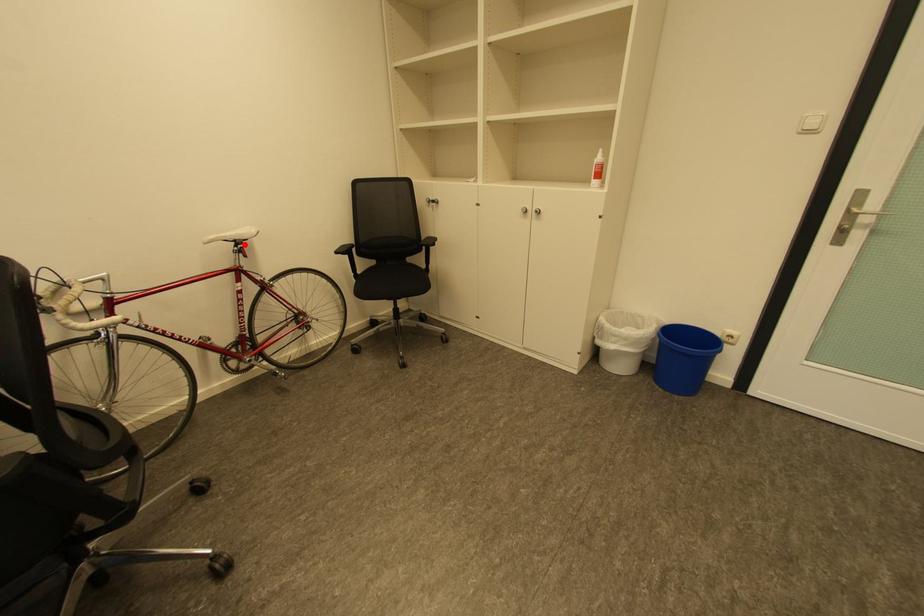
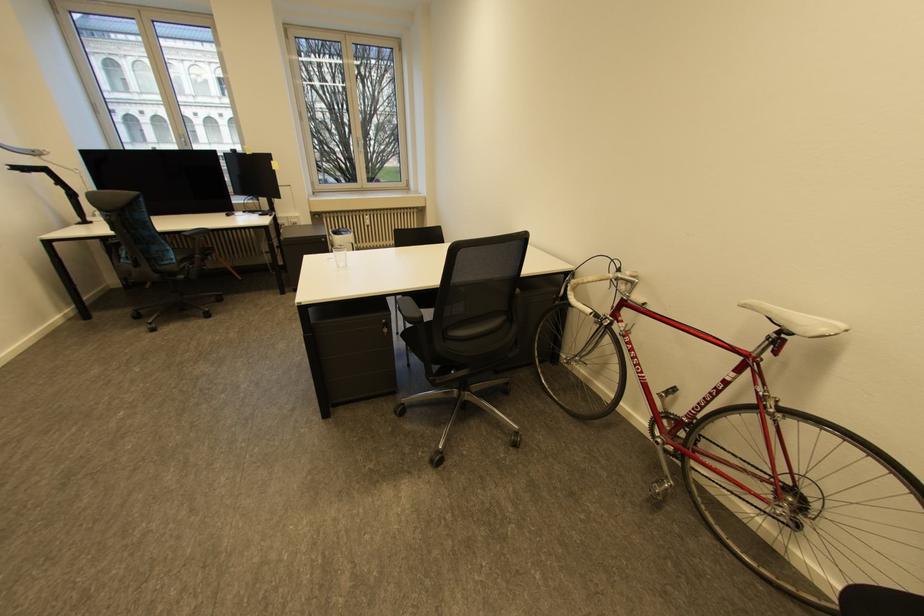
In the second image, find the point that corresponds to the highlighted location in the first image.

(789, 331)